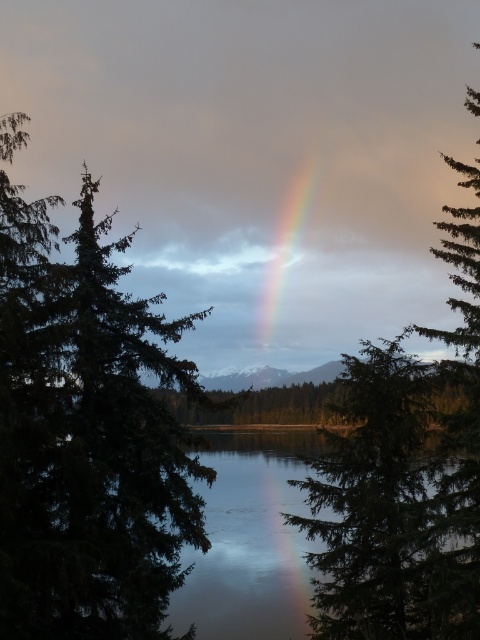
Question: Which point is farther from the camera taking this photo?

Choices:
 (A) (289, 429)
 (B) (278, 285)
 (C) (131, 586)

Answer: (B)

Question: Can you confirm if green matte tree at left is positioned below green matte tree at center?

Choices:
 (A) yes
 (B) no

Answer: (B)

Question: Is green matte tree at center bigger than transparent water at center?

Choices:
 (A) no
 (B) yes

Answer: (A)

Question: Which point appears closest to the camera in this image?

Choices:
 (A) (66, 614)
 (B) (204, 596)
 (C) (309, 186)

Answer: (A)

Question: Is green matte tree at left smaller than green matte tree at center?

Choices:
 (A) no
 (B) yes

Answer: (B)

Question: Which point is closer to the camera taking this photo?

Choices:
 (A) click(x=69, y=269)
 (B) click(x=298, y=637)
 (C) click(x=444, y=634)
 (D) click(x=300, y=189)

Answer: (A)